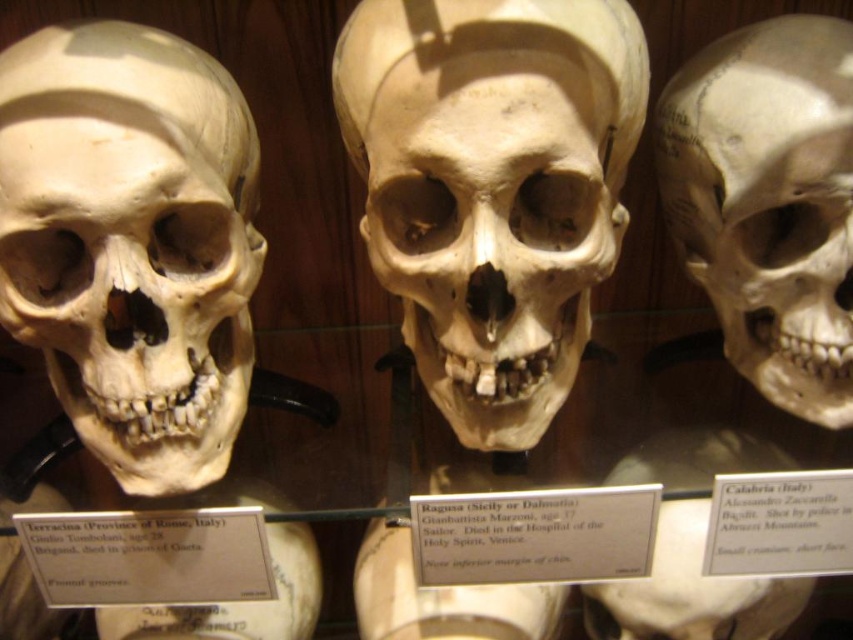
Question: Does matte bone skull at left have a smaller size compared to matte white skull at right?

Choices:
 (A) no
 (B) yes

Answer: (A)

Question: Which of these objects is positioned farthest from the smooth bone skull at center?

Choices:
 (A) white matte skull at center
 (B) matte white skull at right

Answer: (A)

Question: Can you confirm if matte bone skull at left is thinner than matte white skull at center?

Choices:
 (A) no
 (B) yes

Answer: (B)

Question: Is smooth bone skull at center smaller than matte white skull at center?

Choices:
 (A) no
 (B) yes

Answer: (A)

Question: Which of the following is the closest to the observer?

Choices:
 (A) matte bone skull at left
 (B) matte white skull at center
 (C) matte white skull at right
 (D) smooth bone skull at center

Answer: (D)

Question: Which of these objects is positioned closest to the matte white skull at center?

Choices:
 (A) matte bone skull at left
 (B) matte white skull at right

Answer: (A)